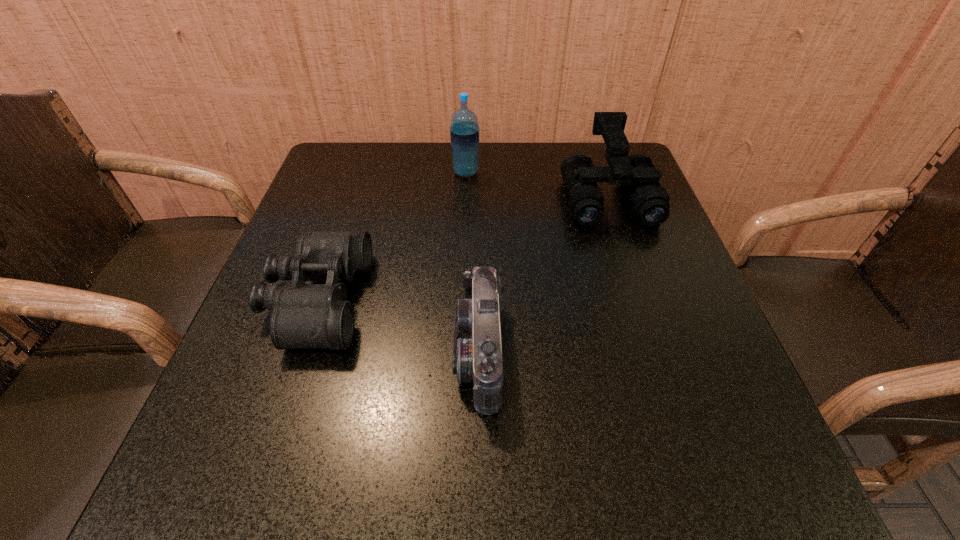
Where is `vacant space at the right edge of the desktop`? The image size is (960, 540). vacant space at the right edge of the desktop is located at coordinates (647, 352).

Locate an element on the screen. vacant space at the near right corner of the desktop is located at coordinates (694, 479).

The width and height of the screenshot is (960, 540). Find the location of `empty location between the water bottle and the leftmost object`. empty location between the water bottle and the leftmost object is located at coordinates (392, 237).

Find the location of `free space between the water bottle and the camcorder`. free space between the water bottle and the camcorder is located at coordinates (473, 262).

Find the location of a particular element. This screenshot has height=540, width=960. free point between the camcorder and the rightmost object is located at coordinates (543, 274).

Identify the location of blank region between the camcorder and the taller binoculars. click(x=543, y=274).

In order to click on free space that is in between the camcorder and the farther binoculars in this screenshot , I will do `click(543, 274)`.

Locate an element on the screen. Image resolution: width=960 pixels, height=540 pixels. vacant area that lies between the rightmost object and the tallest object is located at coordinates (537, 184).

In order to click on free space between the camcorder and the water bottle in this screenshot , I will do `click(473, 262)`.

At what (x,y) coordinates should I click in order to perform the action: click on empty space that is in between the shorter binoculars and the tallest object. Please return your answer as a coordinate pair (x, y). The image size is (960, 540). Looking at the image, I should click on (392, 237).